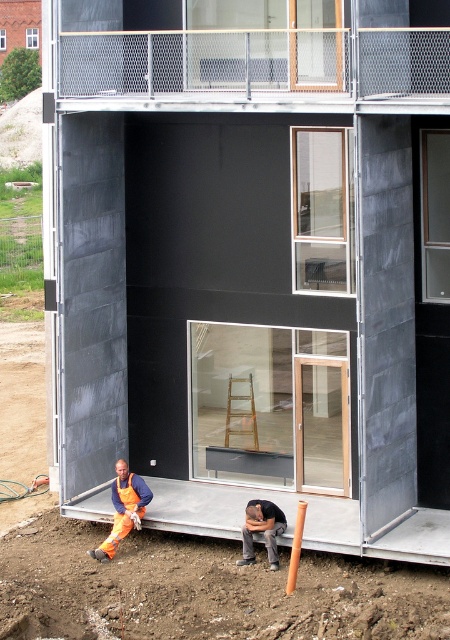
Is orange coveralls at lower left positioned at the back of dark gray fabric pants at lower center?

That is True.

Can you confirm if orange coveralls at lower left is taller than dark gray fabric pants at lower center?

Indeed, orange coveralls at lower left has a greater height compared to dark gray fabric pants at lower center.

Describe the element at coordinates (122, 508) in the screenshot. I see `orange coveralls at lower left` at that location.

Where is `orange coveralls at lower left`? orange coveralls at lower left is located at coordinates (122, 508).

Who is shorter, orange coveralls at lower left or orange fabric safety vest at lower left?

orange fabric safety vest at lower left

Is point (148, 490) in front of point (136, 502)?

No, (148, 490) is further to viewer.

Who is more forward, (90, 548) or (116, 484)?

Point (90, 548) is in front.

This screenshot has height=640, width=450. I want to click on orange coveralls at lower left, so click(x=122, y=508).

Does dark gray fabric pants at lower center appear under orange fabric safety vest at lower left?

Yes, dark gray fabric pants at lower center is below orange fabric safety vest at lower left.

Which of these two, dark gray fabric pants at lower center or orange fabric safety vest at lower left, stands shorter?

With less height is orange fabric safety vest at lower left.

Does point (250, 513) come closer to viewer compared to point (134, 497)?

Yes, it is in front of point (134, 497).

In order to click on dark gray fabric pants at lower center in this screenshot , I will do `click(261, 529)`.